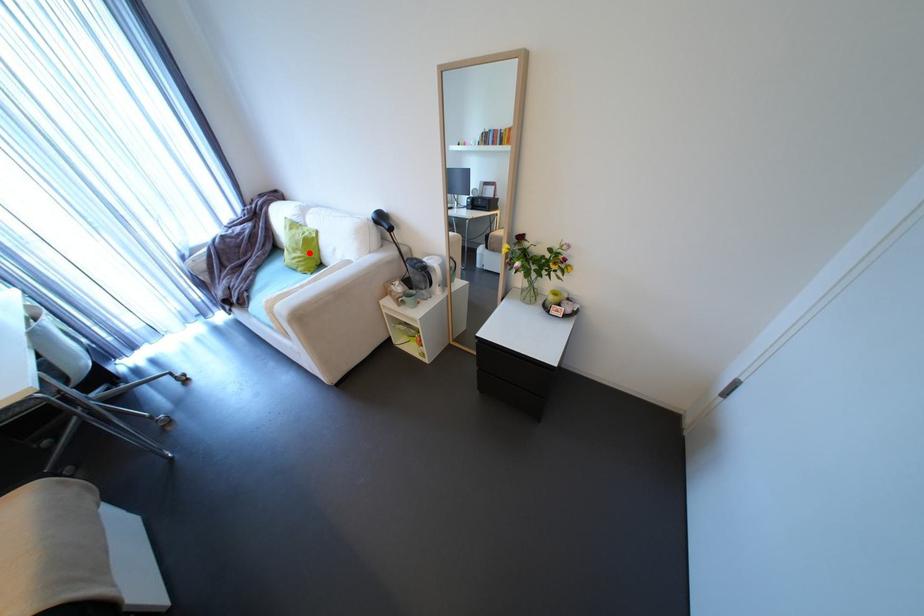
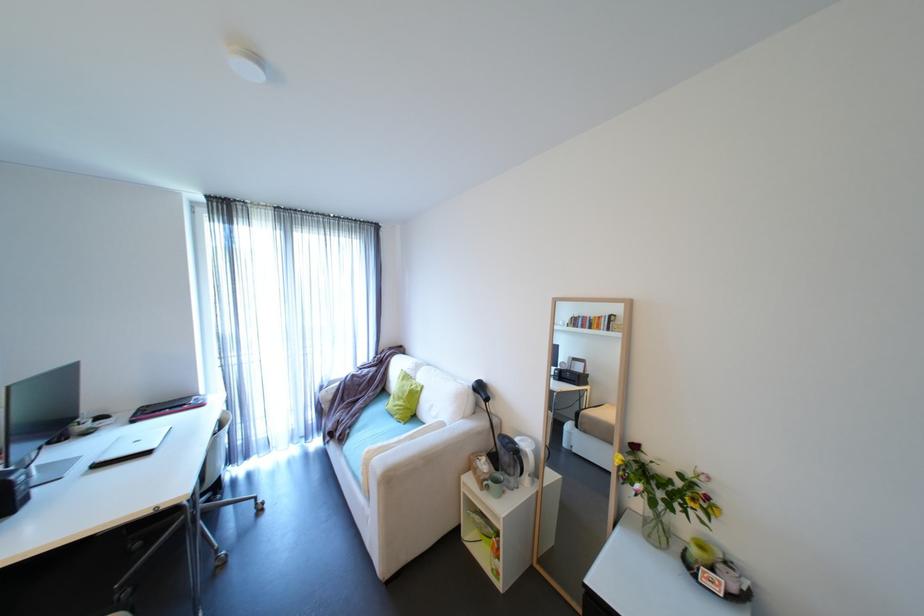
In the second image, find the point that corresponds to the highlighted location in the first image.

(411, 402)